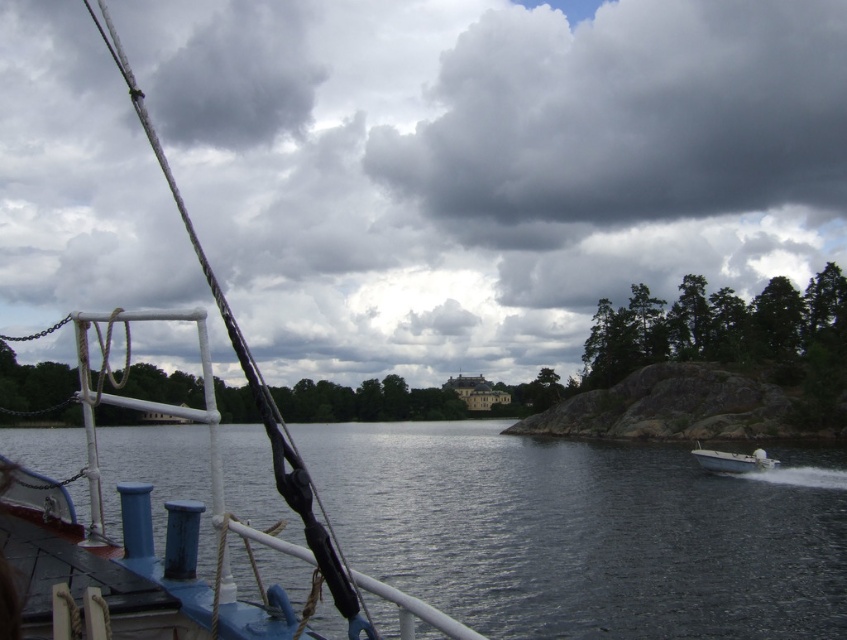
Is dark gray cloud at upper center positioned in front of dark gray fluffy cloud at upper center?

Yes, dark gray cloud at upper center is in front of dark gray fluffy cloud at upper center.

Where is `dark gray cloud at upper center`? The image size is (847, 640). dark gray cloud at upper center is located at coordinates (490, 164).

The image size is (847, 640). What do you see at coordinates (490, 164) in the screenshot?
I see `dark gray cloud at upper center` at bounding box center [490, 164].

Where is `dark gray cloud at upper center`? The height and width of the screenshot is (640, 847). dark gray cloud at upper center is located at coordinates (490, 164).

Is dark gray cloud at upper center above blue matte boat at left?

Yes.

Is dark gray cloud at upper center positioned before blue matte boat at left?

No.

The image size is (847, 640). Find the location of `dark gray cloud at upper center`. dark gray cloud at upper center is located at coordinates 490,164.

Who is lower down, dark blue water at center or dark gray fluffy cloud at upper center?

dark blue water at center is lower down.

Based on the photo, is dark blue water at center above dark gray fluffy cloud at upper center?

Incorrect, dark blue water at center is not positioned above dark gray fluffy cloud at upper center.

Is point (803, 493) closer to camera compared to point (569, 77)?

Yes.

What are the coordinates of `dark blue water at center` in the screenshot? It's located at (587, 531).